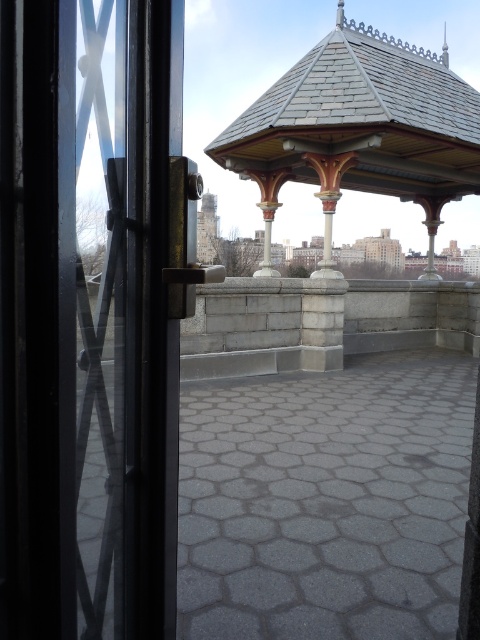
You are standing inside the building and want to exit through the transparent glass door at left. As you look out, you notice the gray slate gazebo at upper center. Which object is taller when viewed from your current position?

The gray slate gazebo at upper center is taller than the transparent glass door at left.

You are standing in a room and want to take a photo of the transparent glass door at left using a camera. The camera requires a minimum distance of 3 feet to focus properly. Can you take the photo without moving closer than the current position?

The transparent glass door at left and camera are 3.36 feet apart from each other. Since 3.36 feet is greater than the minimum required 3 feet, you can take the photo without moving closer.